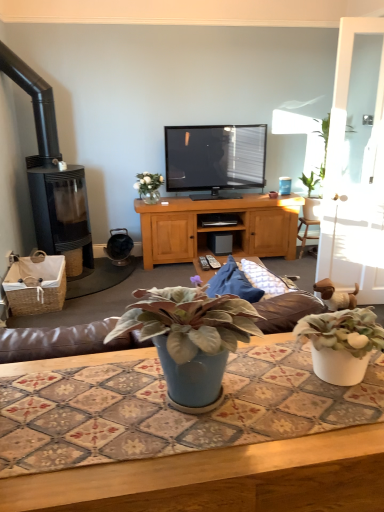
Question: From the image's perspective, does woven brown picnic basket at lower left appear higher than green leafy plant at upper right, acting as the 2th houseplant starting from the left?

Choices:
 (A) no
 (B) yes

Answer: (A)

Question: Considering the relative sizes of woven brown picnic basket at lower left and green leafy plant at upper right, acting as the 2th houseplant starting from the bottom, in the image provided, is woven brown picnic basket at lower left shorter than green leafy plant at upper right, acting as the 2th houseplant starting from the bottom,?

Choices:
 (A) no
 (B) yes

Answer: (B)

Question: Is woven brown picnic basket at lower left further to camera compared to green leafy plant at upper right, positioned as the 1th houseplant in right-to-left order?

Choices:
 (A) yes
 (B) no

Answer: (B)

Question: Considering the relative sizes of woven brown picnic basket at lower left and green leafy plant at upper right, acting as the 2th houseplant starting from the left, in the image provided, is woven brown picnic basket at lower left wider than green leafy plant at upper right, acting as the 2th houseplant starting from the left,?

Choices:
 (A) no
 (B) yes

Answer: (B)

Question: From a real-world perspective, is woven brown picnic basket at lower left located higher than green leafy plant at upper right, which is the 1th houseplant in top-to-bottom order?

Choices:
 (A) yes
 (B) no

Answer: (B)

Question: Is woven brown picnic basket at lower left oriented towards green leafy plant at upper right, positioned as the 1th houseplant in right-to-left order?

Choices:
 (A) yes
 (B) no

Answer: (A)

Question: Would you say translucent glass vase at upper center is a long distance from black glass fireplace at left?

Choices:
 (A) yes
 (B) no

Answer: (B)

Question: Is translucent glass vase at upper center taller than black glass fireplace at left?

Choices:
 (A) no
 (B) yes

Answer: (A)

Question: Is translucent glass vase at upper center aimed at black glass fireplace at left?

Choices:
 (A) no
 (B) yes

Answer: (A)

Question: From a real-world perspective, is translucent glass vase at upper center located higher than black glass fireplace at left?

Choices:
 (A) yes
 (B) no

Answer: (B)

Question: Is translucent glass vase at upper center smaller than black glass fireplace at left?

Choices:
 (A) yes
 (B) no

Answer: (A)

Question: Is translucent glass vase at upper center to the left of black glass fireplace at left from the viewer's perspective?

Choices:
 (A) no
 (B) yes

Answer: (A)

Question: Does blue ceramic table at center come behind black glass fireplace at left?

Choices:
 (A) no
 (B) yes

Answer: (A)